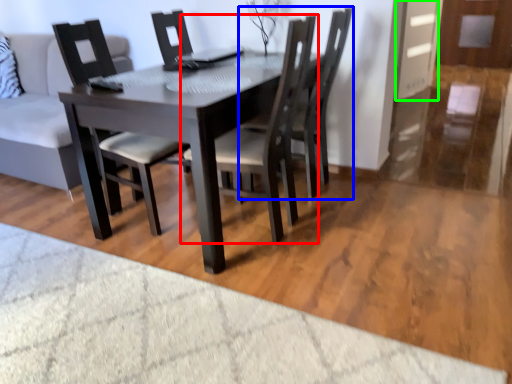
Question: Which object is positioned closest to chair (highlighted by a red box)? Select from chair (highlighted by a blue box) and glass door (highlighted by a green box).

Choices:
 (A) chair
 (B) glass door

Answer: (A)